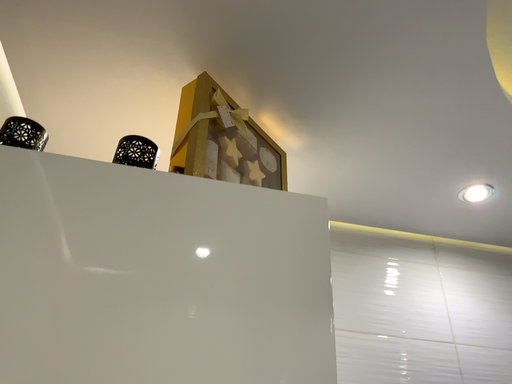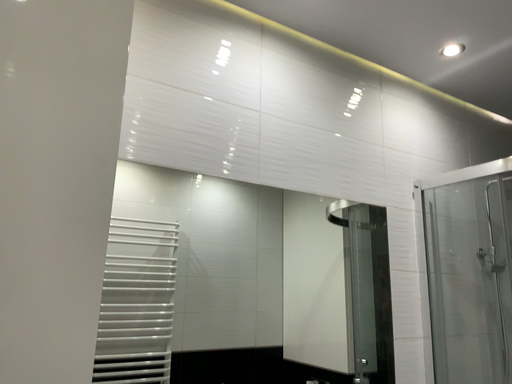
Question: Which way did the camera rotate in the video?

Choices:
 (A) rotated downward
 (B) rotated upward

Answer: (A)